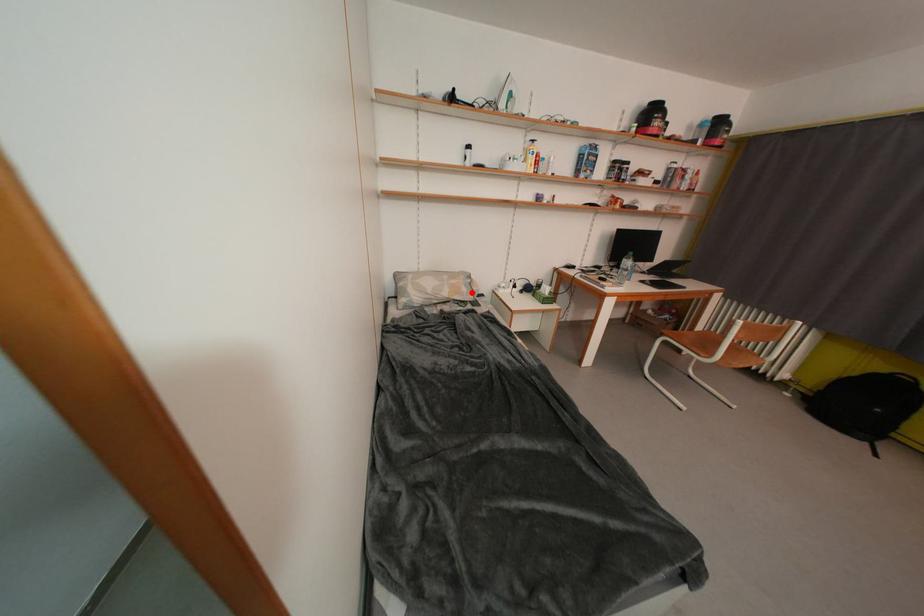
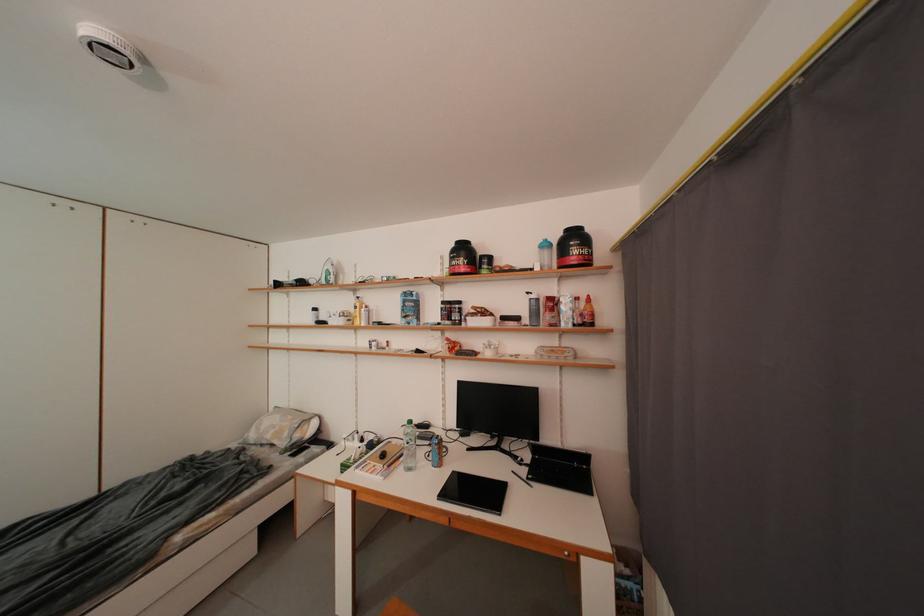
Question: A red point is marked in image1. In image2, is the corresponding 3D point closer to the camera or farther? Reply with the corresponding letter.

Choices:
 (A) The corresponding 3D point is closer.
 (B) The corresponding 3D point is farther.

Answer: (B)